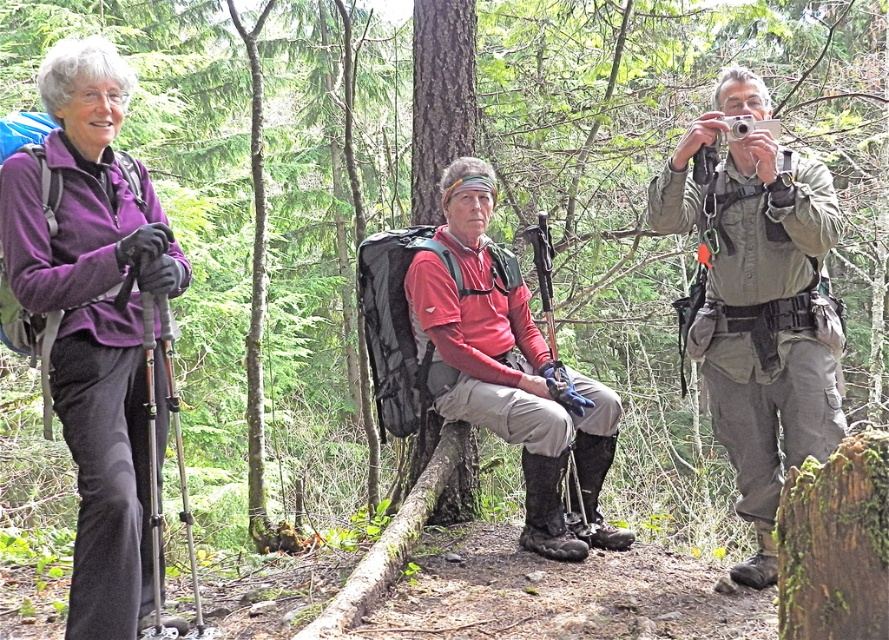
Who is more forward, (113,81) or (583,477)?

Positioned in front is point (113,81).

Can you confirm if purple fleece jacket at left is positioned above reddish-pink fabric shirt at center?

Yes, purple fleece jacket at left is above reddish-pink fabric shirt at center.

The image size is (889, 640). Identify the location of purple fleece jacket at left. coord(93,316).

Locate an element on the screen. This screenshot has height=640, width=889. purple fleece jacket at left is located at coordinates (93, 316).

Does purple fleece jacket at left have a lesser height compared to matte red shirt at center?

In fact, purple fleece jacket at left may be taller than matte red shirt at center.

Does purple fleece jacket at left appear under matte red shirt at center?

Correct, purple fleece jacket at left is located below matte red shirt at center.

Does point (103, 154) lie in front of point (721, 438)?

Yes, it is.

Identify the location of purple fleece jacket at left. (93, 316).

Is point (105, 209) in front of point (749, 141)?

That is True.

Does purple fleece jacket at left have a greater height compared to green camouflage pants at right?

Correct, purple fleece jacket at left is much taller as green camouflage pants at right.

Who is more forward, (119, 156) or (707, 237)?

Point (119, 156) is more forward.

This screenshot has height=640, width=889. Identify the location of purple fleece jacket at left. (93, 316).